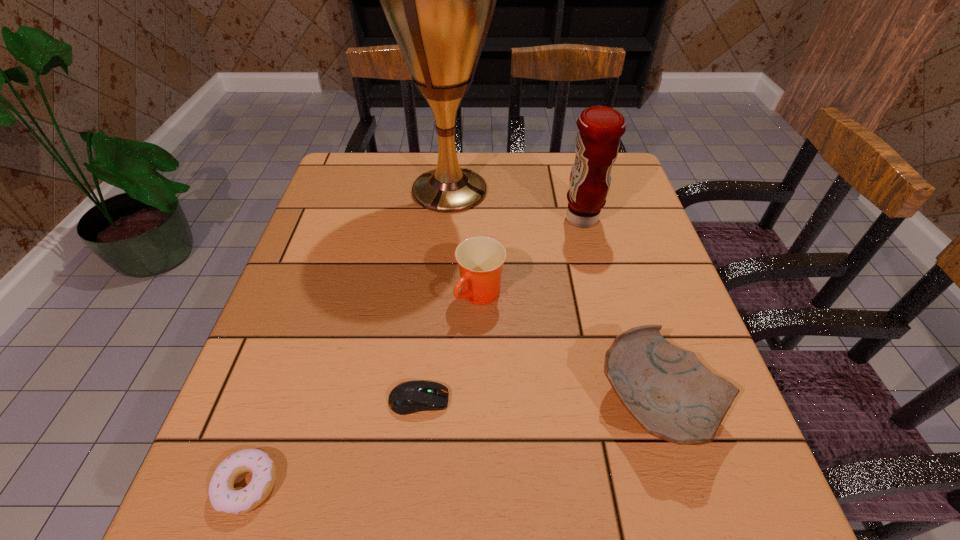
The width and height of the screenshot is (960, 540). What are the coordinates of `free spot that satisfies the following two spatial constraints: 1. on the button of the computer equipment; 2. on the left side of the third shortest object` in the screenshot? It's located at (419, 403).